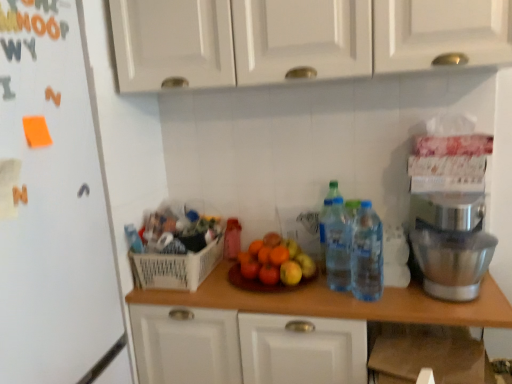
The height and width of the screenshot is (384, 512). Find the location of `free space in front of translucent plastic bottles at center right`. free space in front of translucent plastic bottles at center right is located at coordinates (385, 309).